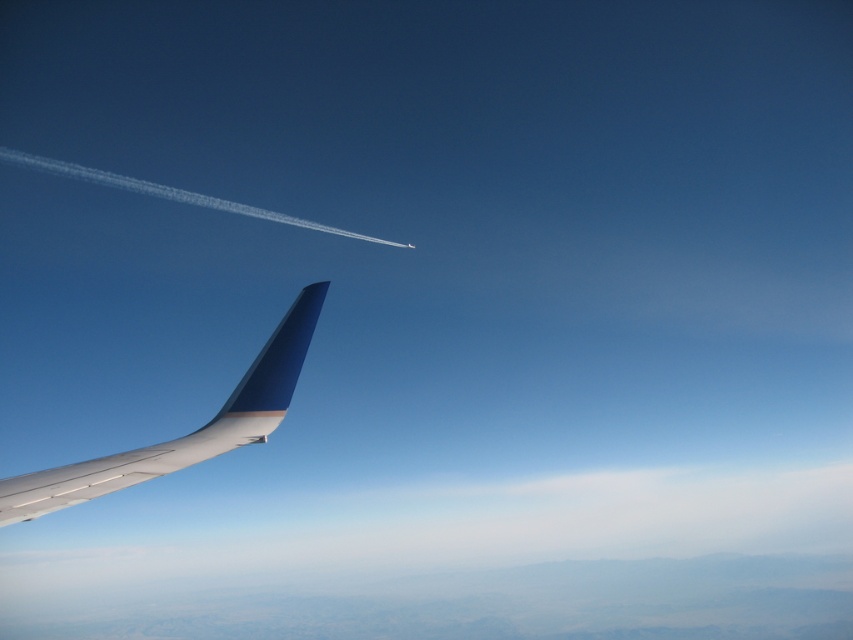
You are a passenger sitting at the window seat and looking outside. You see the white fluffy cloud at lower center and the metallic blue winglet at lower left. Which object is closer to the airplane?

The white fluffy cloud at lower center is closer to the airplane because it is located below the metallic blue winglet at lower left, which is part of the aircraft itself.

You are a passenger looking out the window of the airplane. You see the white fluffy cloud at lower center and the metallic blue winglet at lower left. Which object is closer to you?

The white fluffy cloud at lower center is closer to you because the metallic blue winglet at lower left is behind it.

You are a pilot who needs to navigate around the white fluffy cloud at lower center. Given that the cloud is located at coordinates point 0.827, 0.494, can you determine its position relative to the wingtip of the aircraft?

The white fluffy cloud at lower center is positioned at coordinates point (421,529), which places it in the lower central area of the image, near the wingtip but not directly obstructing it. Since the wingtip is in the foreground and the cloud is in the mid to lower center, the cloud is slightly ahead and to the side of the wingtip from the pilot perspective.